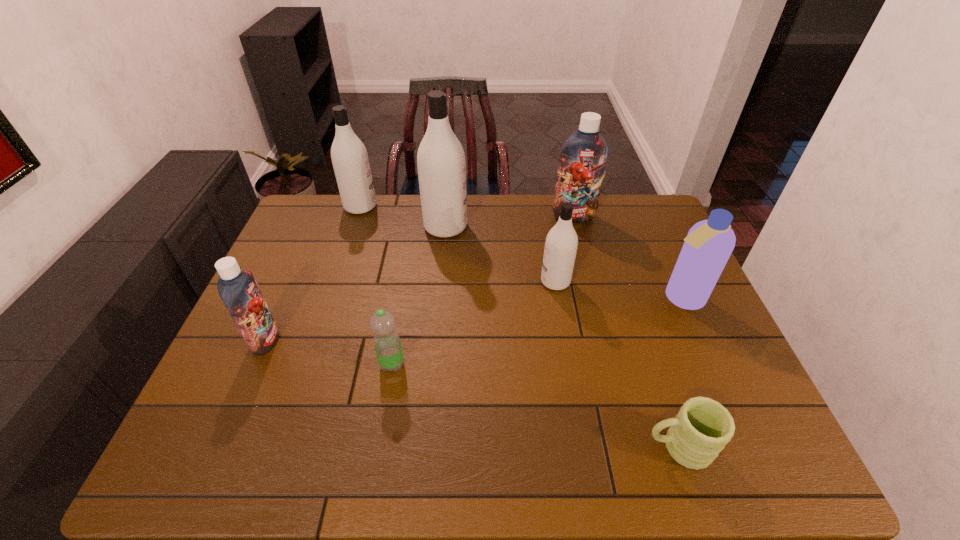
At what (x,y) coordinates should I click in order to perform the action: click on free space located 0.210m on the front-facing side of the smallest white shampoo. Please return your answer as a coordinate pair (x, y). This screenshot has height=540, width=960. Looking at the image, I should click on tap(469, 281).

At what (x,y) coordinates should I click in order to perform the action: click on vacant space located 0.380m on the front-facing side of the smallest white shampoo. Please return your answer as a coordinate pair (x, y). Image resolution: width=960 pixels, height=540 pixels. Looking at the image, I should click on (412, 281).

Where is `free location located 0.130m on the front-facing side of the smallest white shampoo`? free location located 0.130m on the front-facing side of the smallest white shampoo is located at coordinates (496, 281).

The width and height of the screenshot is (960, 540). I want to click on free space located 0.100m on the right of the green water bottle, so click(445, 364).

The height and width of the screenshot is (540, 960). I want to click on vacant space situated on the side of the mug with the handle, so click(x=513, y=447).

The width and height of the screenshot is (960, 540). I want to click on free spot located 0.400m on the side of the mug with the handle, so click(456, 447).

The image size is (960, 540). What are the coordinates of `blank area located 0.070m on the side of the mug with the handle` in the screenshot? It's located at pos(611,447).

I want to click on object situated at the near edge, so click(x=699, y=432).

Identify the location of shampoo present at the right edge. (709, 243).

The width and height of the screenshot is (960, 540). In order to click on mug that is at the right edge in this screenshot , I will do 699,432.